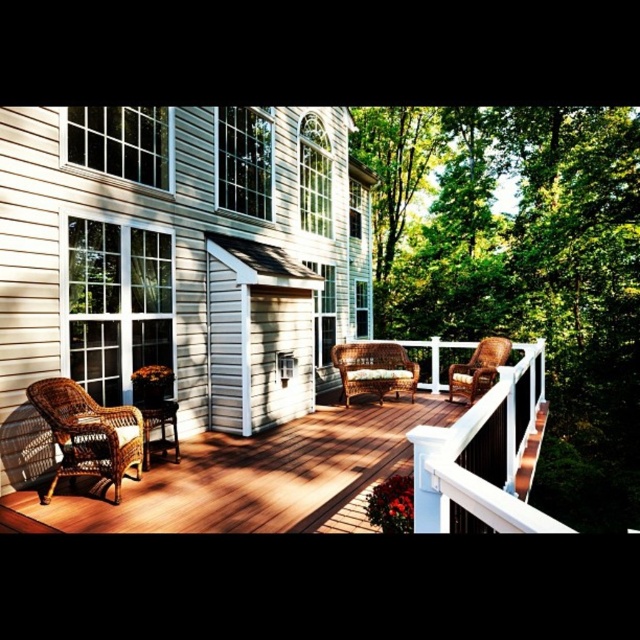
Question: Can you confirm if beige siding at left is positioned below brown wicker chair at left?

Choices:
 (A) no
 (B) yes

Answer: (B)

Question: Estimate the real-world distances between objects in this image. Which object is closer to the woven rattan chair at center?

Choices:
 (A) beige siding at left
 (B) woven wicker chairs at lower left
 (C) woven wicker chair at lower left
 (D) brown wicker chair at left

Answer: (A)

Question: Where is woven brown wicker settee at center located in relation to woven rattan chair at center in the image?

Choices:
 (A) above
 (B) below

Answer: (B)

Question: Does beige siding at left have a larger size compared to woven wicker chairs at lower left?

Choices:
 (A) yes
 (B) no

Answer: (A)

Question: Which point appears closest to the camera in this image?

Choices:
 (A) (396, 380)
 (B) (125, 426)
 (C) (465, 480)
 (D) (346, 202)

Answer: (C)

Question: Which point is farther to the camera?

Choices:
 (A) (340, 397)
 (B) (173, 408)
 (C) (454, 371)

Answer: (A)